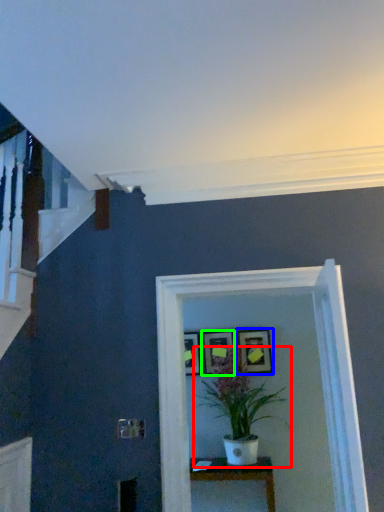
Question: Considering the real-world distances, which object is closest to houseplant (highlighted by a red box)? picture frame (highlighted by a blue box) or picture frame (highlighted by a green box).

Choices:
 (A) picture frame
 (B) picture frame

Answer: (A)